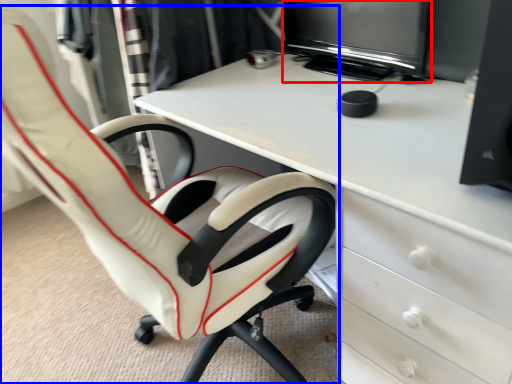
Question: Which object is further to the camera taking this photo, computer monitor (highlighted by a red box) or chair (highlighted by a blue box)?

Choices:
 (A) computer monitor
 (B) chair

Answer: (A)